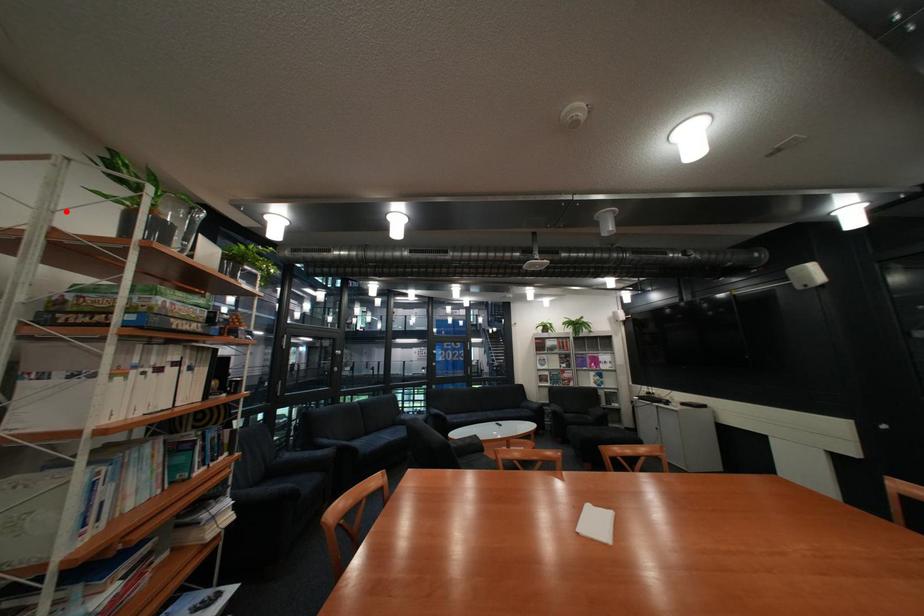
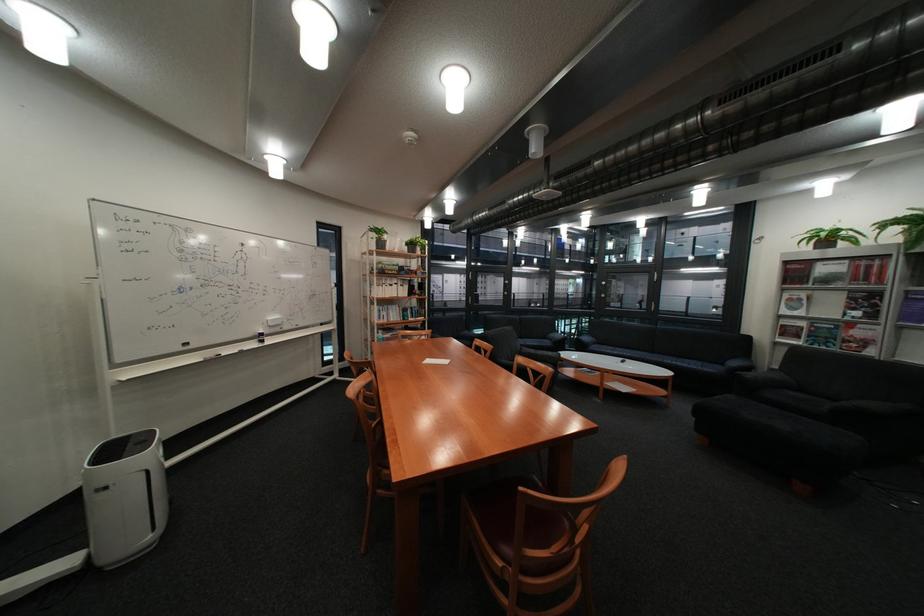
Find the pixel in the second image that matches the highlighted location in the first image.

(383, 246)